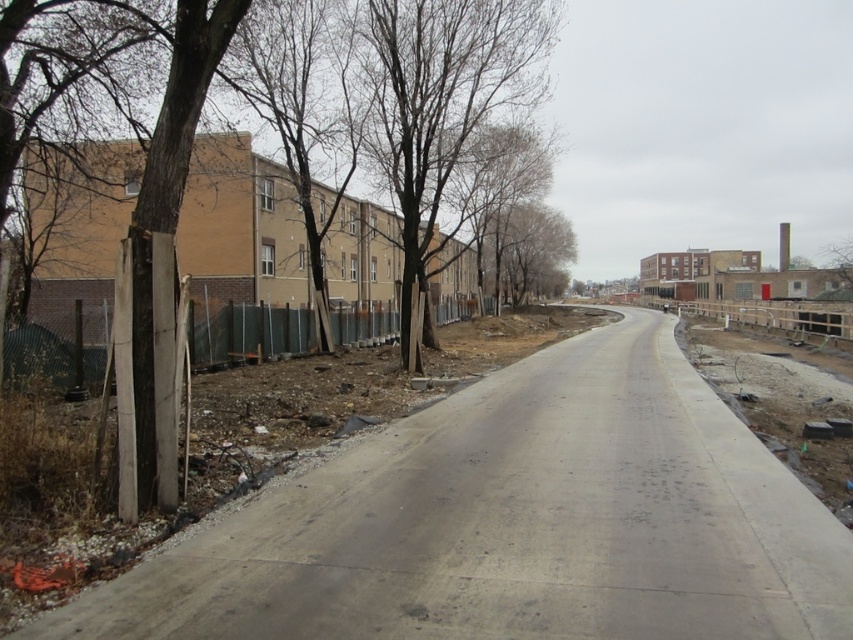
Question: Among these points, which one is nearest to the camera?

Choices:
 (A) (648, 385)
 (B) (213, 324)
 (C) (547, 269)

Answer: (A)

Question: Can you confirm if wooden fence at left is thinner than bare branches at center?

Choices:
 (A) no
 (B) yes

Answer: (B)

Question: Among these objects, which one is nearest to the camera?

Choices:
 (A) gray concrete alley at left
 (B) wooden fence at left
 (C) brown bark tree at upper center

Answer: (A)

Question: Which object is positioned closest to the brown bark tree at upper center?

Choices:
 (A) gray concrete alley at left
 (B) bare branches at center

Answer: (A)

Question: Is brown bark tree at upper center smaller than wooden fence at left?

Choices:
 (A) yes
 (B) no

Answer: (A)

Question: Does wooden fence at left come behind bare branches at center?

Choices:
 (A) no
 (B) yes

Answer: (A)